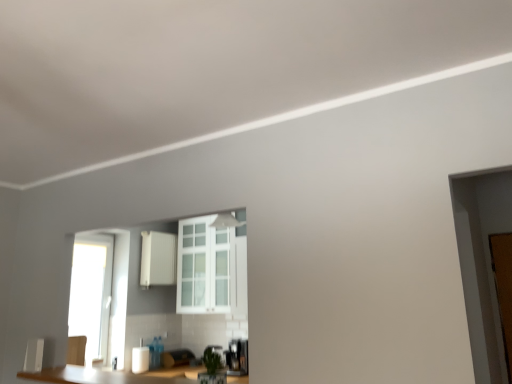
Question: From the image's perspective, is white matte cabinet at center located beneath white glossy paper towel dispenser at lower center?

Choices:
 (A) yes
 (B) no

Answer: (B)

Question: Does white matte cabinet at center have a greater width compared to white glossy paper towel dispenser at lower center?

Choices:
 (A) yes
 (B) no

Answer: (B)

Question: Is white matte cabinet at center further to camera compared to white glossy paper towel dispenser at lower center?

Choices:
 (A) yes
 (B) no

Answer: (A)

Question: Is white matte cabinet at center outside white glossy paper towel dispenser at lower center?

Choices:
 (A) no
 (B) yes

Answer: (B)

Question: Does white matte cabinet at center appear on the right side of white glossy paper towel dispenser at lower center?

Choices:
 (A) yes
 (B) no

Answer: (A)

Question: Considering the relative positions of white matte cabinet at center and white glossy paper towel dispenser at lower center in the image provided, is white matte cabinet at center to the left of white glossy paper towel dispenser at lower center from the viewer's perspective?

Choices:
 (A) yes
 (B) no

Answer: (B)

Question: Can you confirm if brown wooden door at right is thinner than white matte cabinet at center?

Choices:
 (A) yes
 (B) no

Answer: (A)

Question: Can you confirm if brown wooden door at right is wider than white matte cabinet at center?

Choices:
 (A) no
 (B) yes

Answer: (A)

Question: From a real-world perspective, is brown wooden door at right on white matte cabinet at center?

Choices:
 (A) no
 (B) yes

Answer: (A)

Question: From the image's perspective, is brown wooden door at right above white matte cabinet at center?

Choices:
 (A) no
 (B) yes

Answer: (A)

Question: From a real-world perspective, is brown wooden door at right physically below white matte cabinet at center?

Choices:
 (A) yes
 (B) no

Answer: (A)

Question: Is brown wooden door at right positioned far away from white matte cabinet at center?

Choices:
 (A) no
 (B) yes

Answer: (B)

Question: Could white glass cabinet at center be considered to be inside white matte cabinet at center?

Choices:
 (A) yes
 (B) no

Answer: (B)